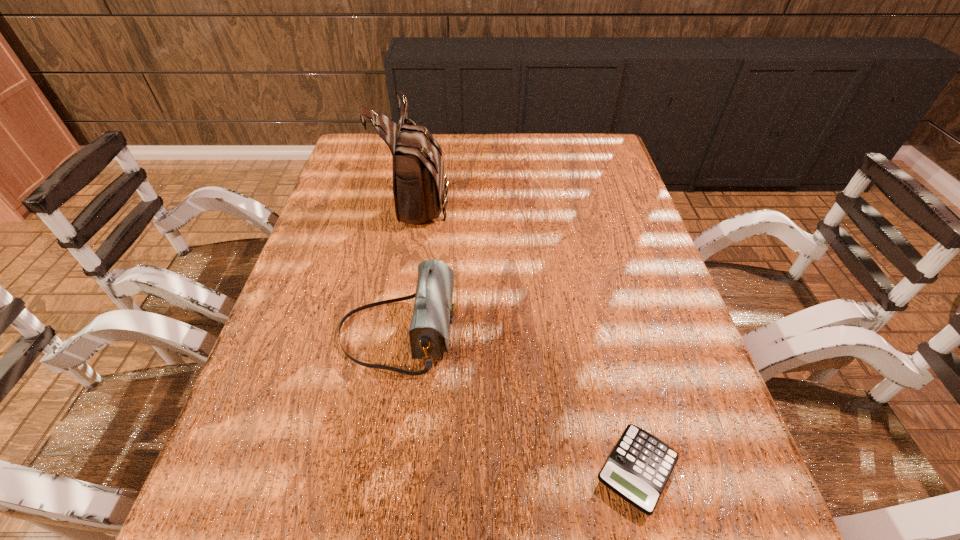
The image size is (960, 540). What are the coordinates of `free area in between the shorter shoulder bag and the farther shoulder bag` in the screenshot? It's located at (408, 266).

Identify the location of vacant area that lies between the tallest object and the nearest object. (528, 335).

Where is `vacant area between the tallest object and the calculator`? The height and width of the screenshot is (540, 960). vacant area between the tallest object and the calculator is located at coordinates (528, 335).

At what (x,y) coordinates should I click in order to perform the action: click on vacant space that's between the shorter shoulder bag and the nearest object. Please return your answer as a coordinate pair (x, y). The image size is (960, 540). Looking at the image, I should click on (517, 401).

Find the location of `free space that is in between the tallest object and the calculator`. free space that is in between the tallest object and the calculator is located at coordinates (528, 335).

Image resolution: width=960 pixels, height=540 pixels. I want to click on free space between the nearest object and the nearer shoulder bag, so click(x=517, y=401).

In order to click on unoccupied position between the nearest object and the tallest object in this screenshot , I will do `click(528, 335)`.

At what (x,y) coordinates should I click in order to perform the action: click on free point between the shorter shoulder bag and the rightmost object. Please return your answer as a coordinate pair (x, y). Looking at the image, I should click on (517, 401).

Where is `object that is the second closest one to the nearest object`? object that is the second closest one to the nearest object is located at coordinates (419, 187).

Identify the location of object that ranks as the closest to the shorter shoulder bag. (419, 187).